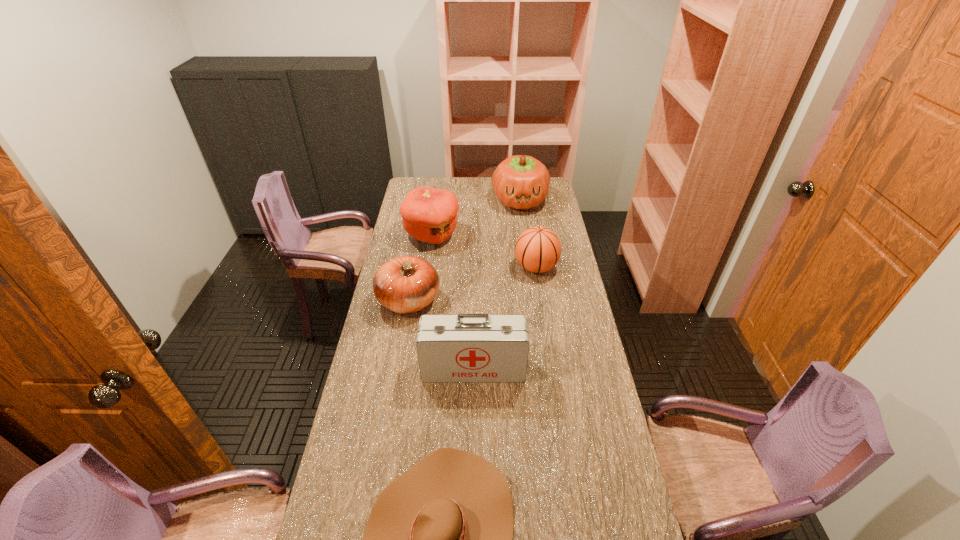
You are a GUI agent. You are given a task and a screenshot of the screen. Output one action in this format:
    pyautogui.click(x=<x>, y=<y>)
    Task: Click on the farthest pumpkin
    Image resolution: width=960 pixels, height=540 pixels.
    Given the screenshot: What is the action you would take?
    [521, 182]

The width and height of the screenshot is (960, 540). In order to click on the farthest object in this screenshot , I will do `click(521, 182)`.

This screenshot has height=540, width=960. I want to click on the second farthest object, so click(x=429, y=215).

Find the location of a particular element. the first-aid kit is located at coordinates (466, 347).

At what (x,y) coordinates should I click in order to perform the action: click on basketball. Please return your answer as a coordinate pair (x, y). The image size is (960, 540). Looking at the image, I should click on tap(538, 249).

Locate an element on the screen. The width and height of the screenshot is (960, 540). the shortest pumpkin is located at coordinates (406, 284).

You are a GUI agent. You are given a task and a screenshot of the screen. Output one action in this format:
    pyautogui.click(x=<x>, y=<y>)
    Task: Click on the vacant space situated on the side of the farthest pumpkin with the cute face
    This screenshot has width=960, height=540.
    Given the screenshot: What is the action you would take?
    pyautogui.click(x=526, y=249)

Find the location of `vacant area situated 0.300m on the back of the fifth nearest object`. vacant area situated 0.300m on the back of the fifth nearest object is located at coordinates (439, 188).

I want to click on free spot located 0.270m on the front-facing side of the first-aid kit, so click(x=472, y=462).

Locate an element on the screen. The width and height of the screenshot is (960, 540). vacant position located 0.170m on the front of the basketball is located at coordinates (542, 312).